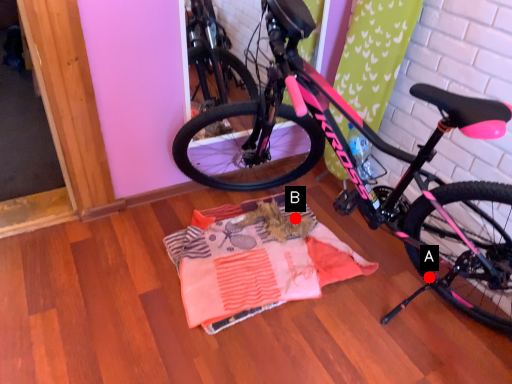
Question: Two points are circled on the image, labeled by A and B beside each circle. Which point is closer to the camera?

Choices:
 (A) A is closer
 (B) B is closer

Answer: (A)